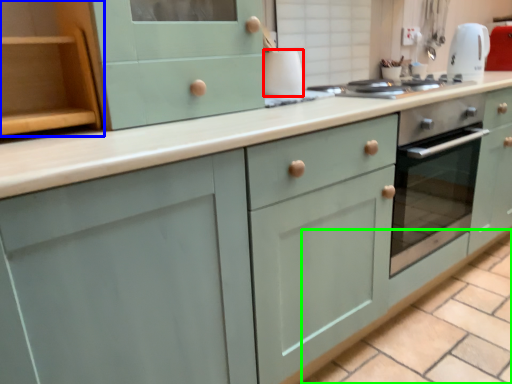
Question: Estimate the real-world distances between objects in this image. Which object is farther from appliance (highlighted by a red box), cabinetry (highlighted by a blue box) or tile (highlighted by a green box)?

Choices:
 (A) cabinetry
 (B) tile

Answer: (B)